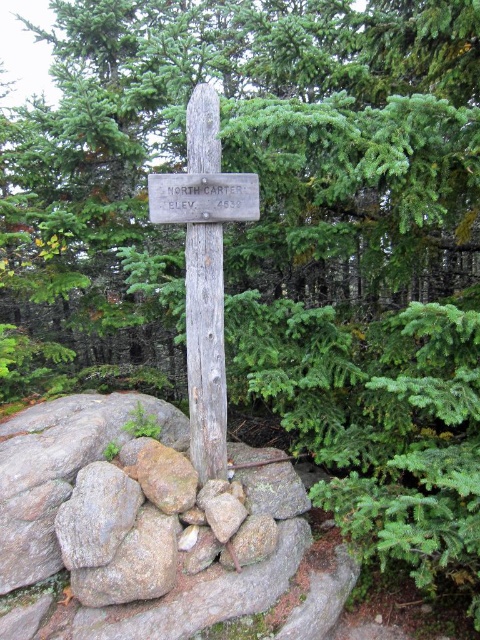
Question: Is weathered wood pole at center to the left of wooden sign at center from the viewer's perspective?

Choices:
 (A) no
 (B) yes

Answer: (B)

Question: Which object is the closest to the wooden sign at center?

Choices:
 (A) weathered wood pole at center
 (B) weathered wood cross at center
 (C) green rough wood sign at center

Answer: (B)

Question: Which point is closer to the camera?

Choices:
 (A) wooden sign at center
 (B) weathered wood pole at center
 (C) weathered wood cross at center

Answer: (C)

Question: Does weathered wood pole at center appear on the right side of wooden sign at center?

Choices:
 (A) yes
 (B) no

Answer: (B)

Question: Is green rough wood sign at center to the left of wooden sign at center from the viewer's perspective?

Choices:
 (A) yes
 (B) no

Answer: (A)

Question: Estimate the real-world distances between objects in this image. Which object is farther from the wooden sign at center?

Choices:
 (A) weathered wood cross at center
 (B) green rough wood sign at center

Answer: (B)